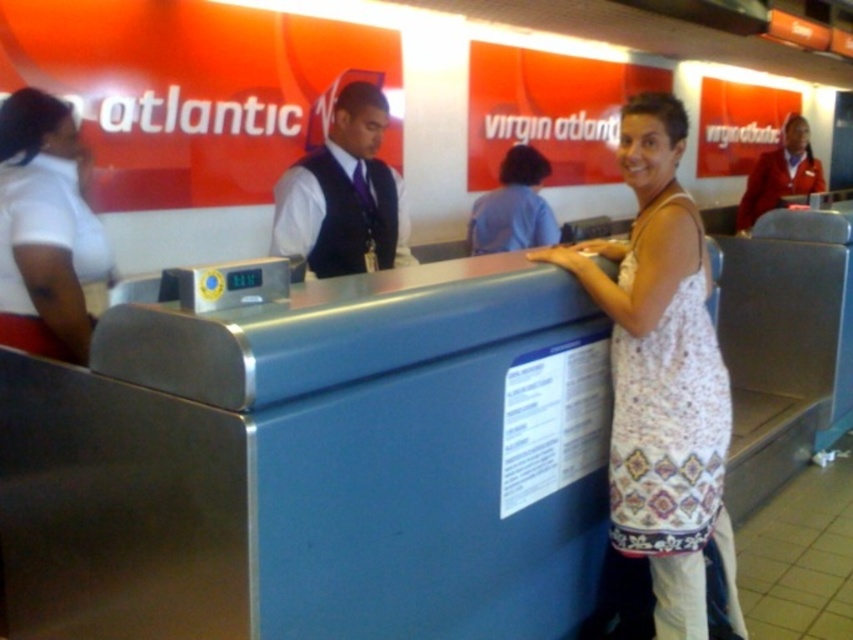
Question: Which point is closer to the camera?

Choices:
 (A) matte black vest at center
 (B) red velvet uniform at upper right
 (C) blue fabric shirt at center
 (D) white printed dress at center

Answer: (D)

Question: Does white printed dress at center have a larger size compared to red velvet uniform at upper right?

Choices:
 (A) no
 (B) yes

Answer: (A)

Question: Among these points, which one is farthest from the camera?

Choices:
 (A) (328, 209)
 (B) (86, 189)
 (C) (506, 180)

Answer: (C)

Question: Considering the real-world distances, which object is farthest from the white matte shirt at left?

Choices:
 (A) matte black vest at center
 (B) blue fabric shirt at center

Answer: (B)

Question: Does white matte shirt at left have a larger size compared to red velvet uniform at upper right?

Choices:
 (A) yes
 (B) no

Answer: (B)

Question: In this image, where is white matte shirt at left located relative to matte black vest at center?

Choices:
 (A) left
 (B) right

Answer: (A)